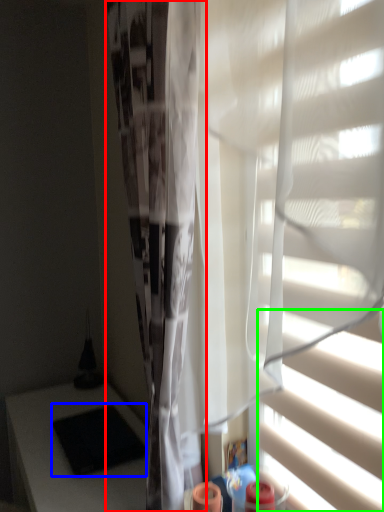
Question: Which object is positioned farthest from shower curtain (highlighted by a red box)? Select from pad (highlighted by a blue box) and blind (highlighted by a green box).

Choices:
 (A) pad
 (B) blind

Answer: (A)